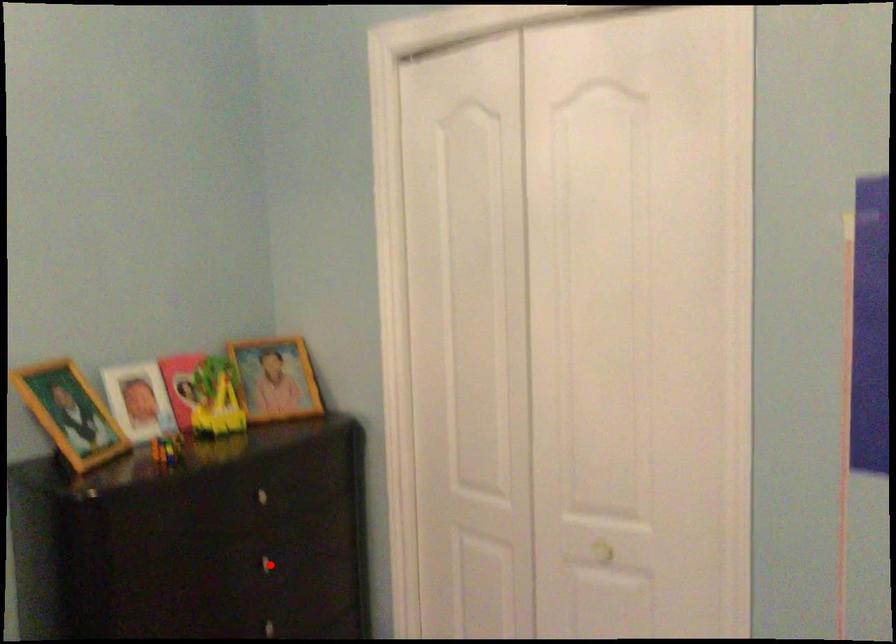
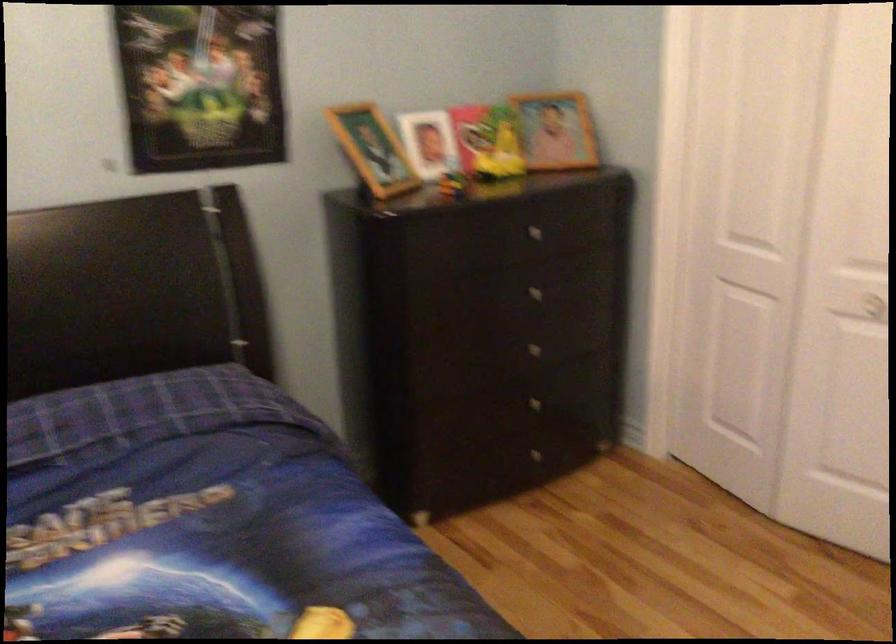
In the second image, find the point that corresponds to the highlighted location in the first image.

(538, 292)